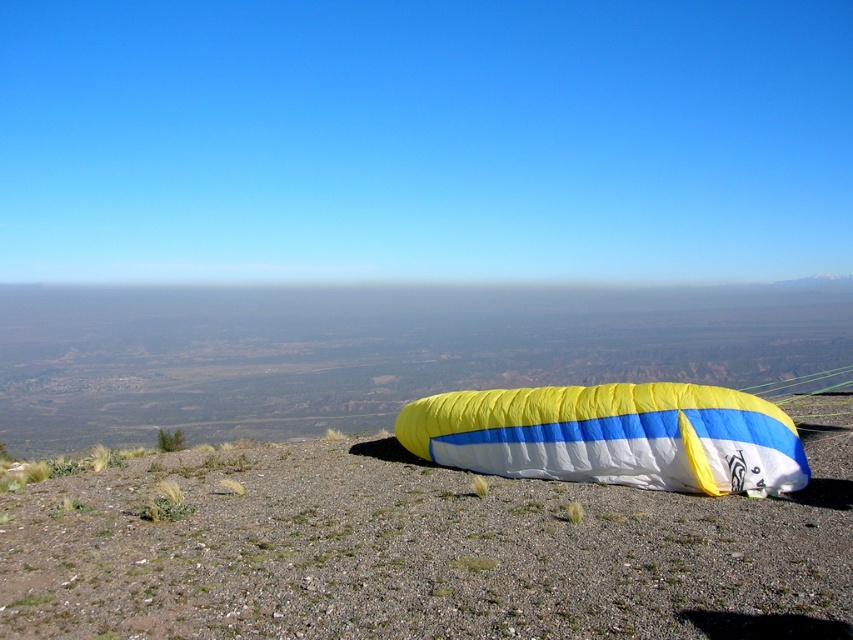
You are a photographer standing at the camera position. You want to take a photo of the yellow fabric parachute at center. Can you reach the parachute without moving the camera? The maximum distance you can walk is 6 meters.

The yellow fabric parachute at center and camera are 6.29 meters apart from each other. Since the maximum distance you can walk is 6 meters, you cannot reach the parachute without moving the camera.

You are standing at the point with coordinates point (425, 548). Looking around, you see the yellow fabric parachute at center. Which direction should you walk to reach the yellow fabric parachute at center?

The yellow fabric parachute at center is represented by point (425, 548), so you are already at the yellow fabric parachute at center.